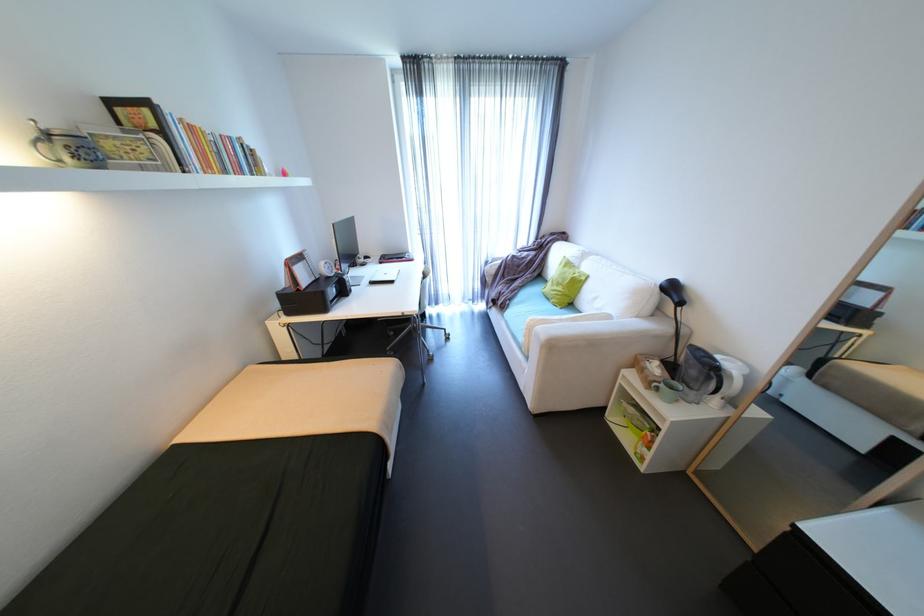
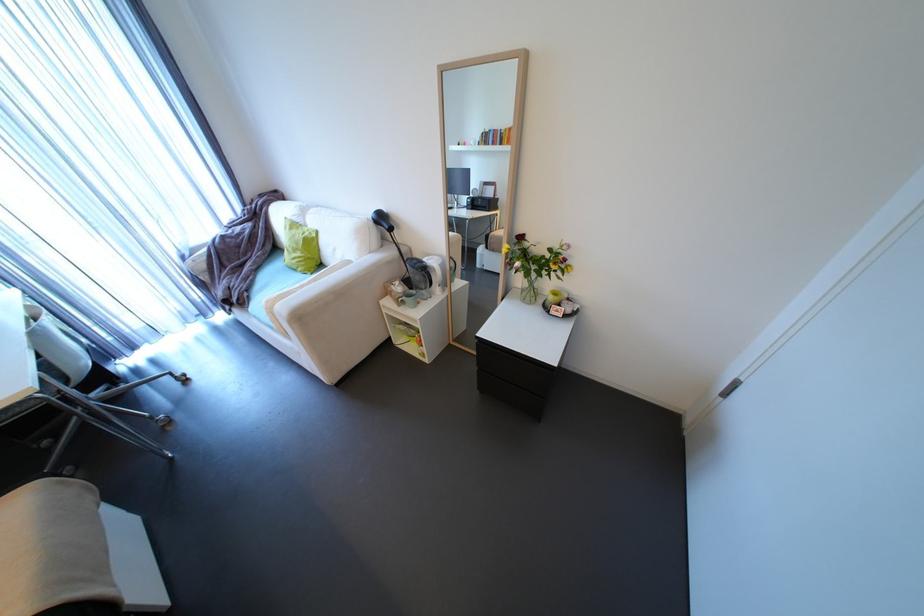
Locate, in the second image, the point that corresponds to (x=664, y=375) in the first image.

(407, 292)